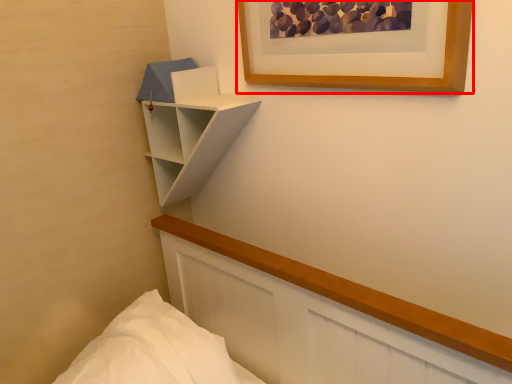
Question: From the image's perspective, what is the correct spatial relationship of picture frame (annotated by the red box) in relation to shelf?

Choices:
 (A) above
 (B) below

Answer: (A)